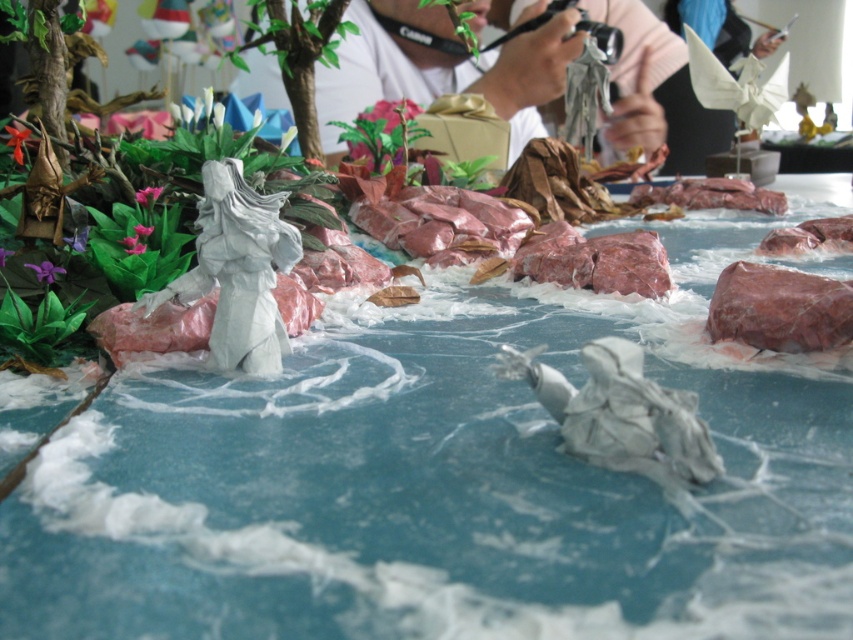
Between pink marble rock at right and matte white paper figure at center, which one appears on the left side from the viewer's perspective?

From the viewer's perspective, pink marble rock at right appears more on the left side.

Can you confirm if pink marble rock at right is smaller than matte white paper figure at center?

Correct, pink marble rock at right occupies less space than matte white paper figure at center.

Identify the location of pink marble rock at right. (779, 308).

Is white paper figure at center closer to the viewer compared to matte white paper figure at center?

That is True.

Is white paper figure at center taller than matte white paper figure at center?

Incorrect, white paper figure at center's height is not larger of matte white paper figure at center's.

You are a GUI agent. You are given a task and a screenshot of the screen. Output one action in this format:
    pyautogui.click(x=<x>, y=<y>)
    Task: Click on the white paper figure at center
    Image resolution: width=853 pixels, height=640 pixels.
    Given the screenshot: What is the action you would take?
    pyautogui.click(x=445, y=480)

Is white paper figure at center bigger than pink marble rock at right?

Yes.

Who is more distant from viewer, [511,316] or [740,308]?

Positioned behind is point [511,316].

Where is `white paper figure at center`? white paper figure at center is located at coordinates (445, 480).